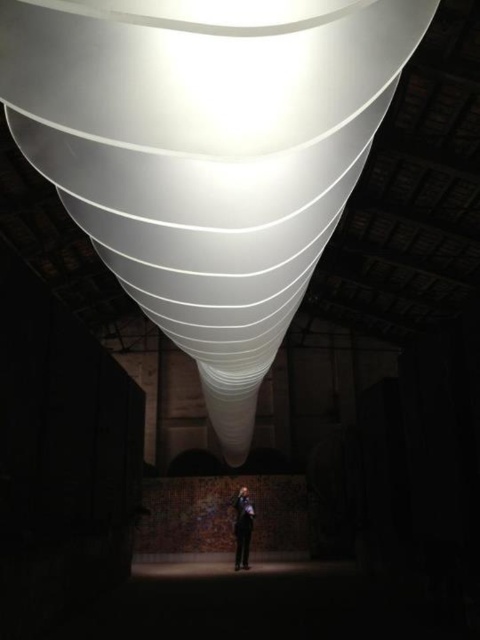
Question: Which point is farther to the camera?

Choices:
 (A) (243, 182)
 (B) (235, 564)

Answer: (B)

Question: Does white glossy cone at center have a greater width compared to black suit at center?

Choices:
 (A) no
 (B) yes

Answer: (B)

Question: Does white glossy cone at center have a lesser width compared to black suit at center?

Choices:
 (A) yes
 (B) no

Answer: (B)

Question: Is white glossy cone at center further to the viewer compared to black suit at center?

Choices:
 (A) yes
 (B) no

Answer: (B)

Question: Which of the following is the closest to the observer?

Choices:
 (A) black suit at center
 (B) white glossy cone at center

Answer: (B)